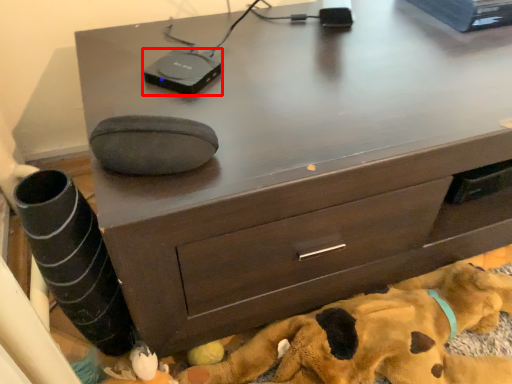
Question: From the image's perspective, considering the relative positions of gadget (annotated by the red box) and dog in the image provided, where is gadget (annotated by the red box) located with respect to the staircase?

Choices:
 (A) above
 (B) below

Answer: (A)